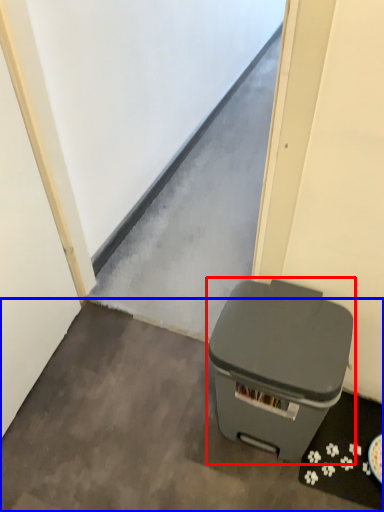
Question: Among these objects, which one is nearest to the camera, waste container (highlighted by a red box) or concrete (highlighted by a blue box)?

Choices:
 (A) waste container
 (B) concrete

Answer: (A)